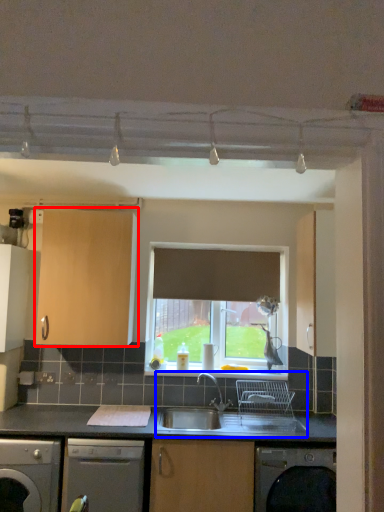
Question: Which of the following is the closest to the observer, cabinetry (highlighted by a red box) or sink (highlighted by a blue box)?

Choices:
 (A) cabinetry
 (B) sink

Answer: (B)